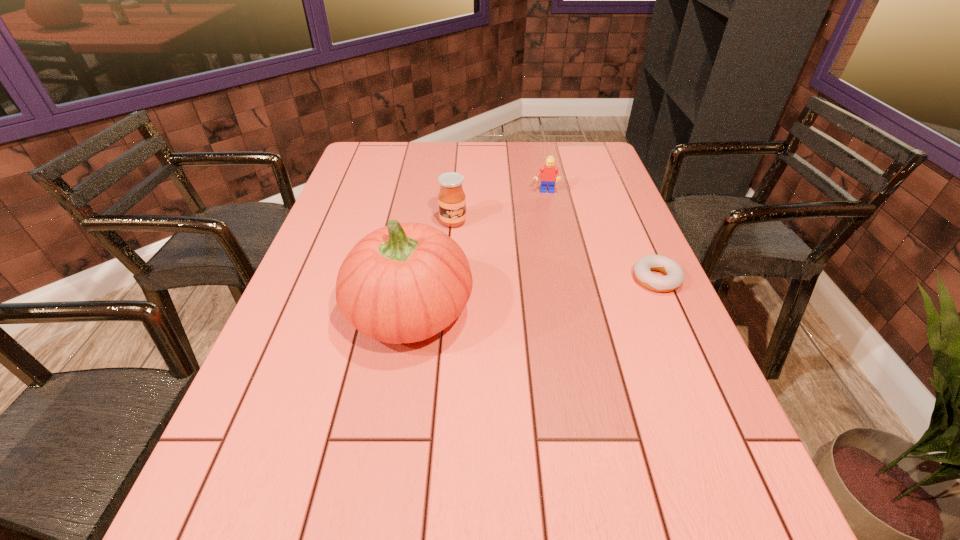
Where is `the tallest object`? The height and width of the screenshot is (540, 960). the tallest object is located at coordinates (403, 283).

The height and width of the screenshot is (540, 960). Identify the location of the shortest object. (674, 273).

I want to click on doughnut, so click(674, 273).

Where is `Lego`? Lego is located at coordinates click(549, 173).

At what (x,y) coordinates should I click in order to perform the action: click on the third tallest object. Please return your answer as a coordinate pair (x, y). This screenshot has height=540, width=960. Looking at the image, I should click on tap(549, 173).

Identify the location of honey. (451, 199).

This screenshot has height=540, width=960. Identify the location of the second tallest object. (451, 199).

This screenshot has width=960, height=540. Find the location of `vacant space positioned 0.080m on the left of the tallest object`. vacant space positioned 0.080m on the left of the tallest object is located at coordinates (313, 311).

The width and height of the screenshot is (960, 540). Find the location of `vacant space located 0.220m on the back of the doughnut`. vacant space located 0.220m on the back of the doughnut is located at coordinates (629, 217).

Where is `free space located on the front-facing side of the farthest object`? Image resolution: width=960 pixels, height=540 pixels. free space located on the front-facing side of the farthest object is located at coordinates (546, 252).